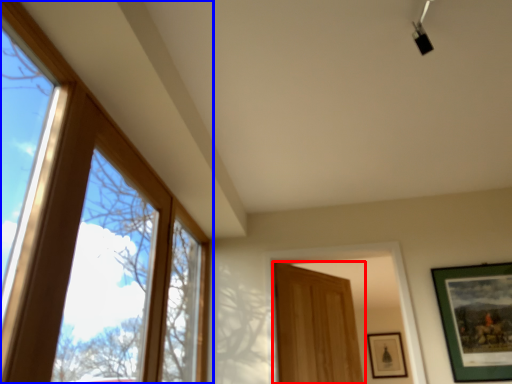
Question: Among these objects, which one is nearest to the camera, door (highlighted by a red box) or window (highlighted by a blue box)?

Choices:
 (A) door
 (B) window

Answer: (B)